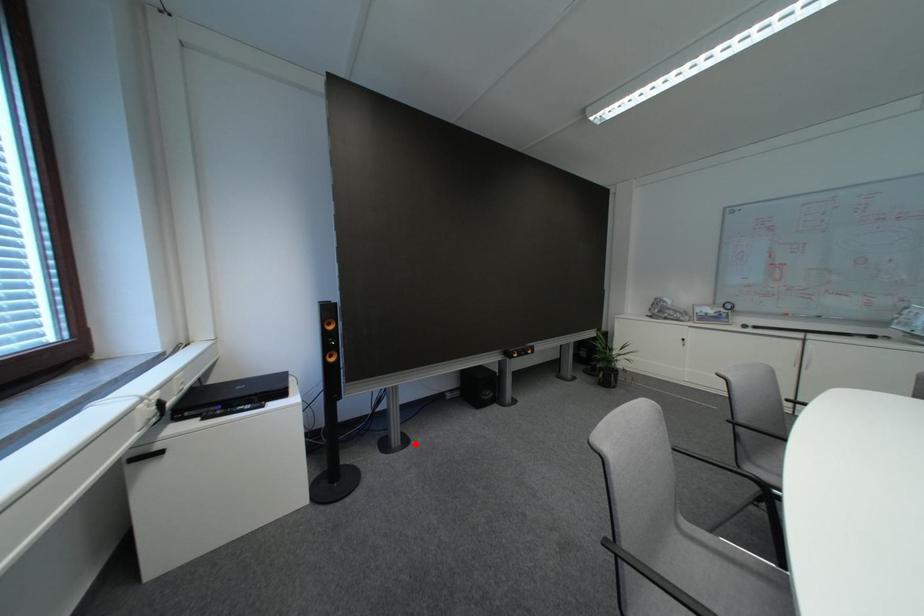
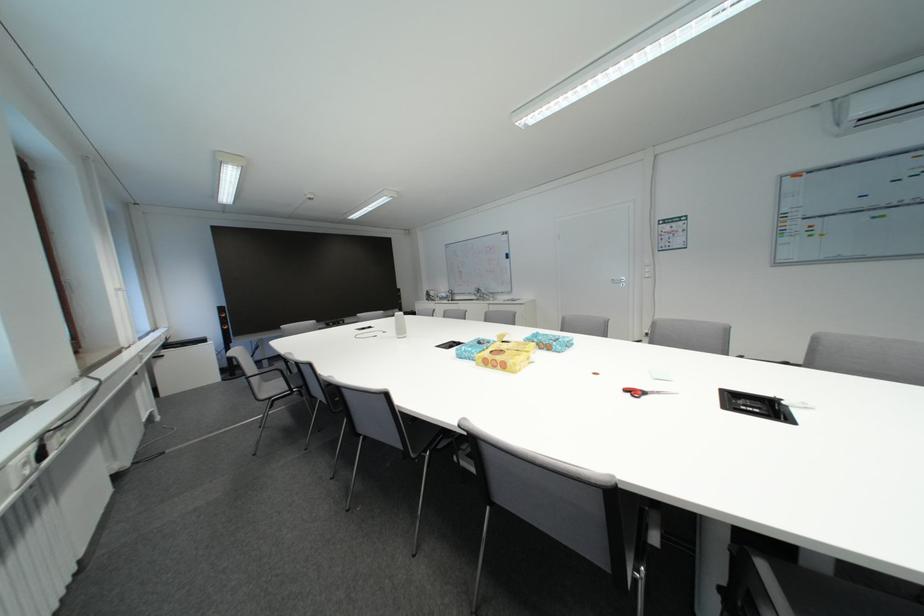
Question: I am providing you with two images of the same scene from different viewpoints. Given a red point in image1, look at the same physical point in image2. Is it:

Choices:
 (A) Closer to the viewpoint
 (B) Farther from the viewpoint

Answer: (B)